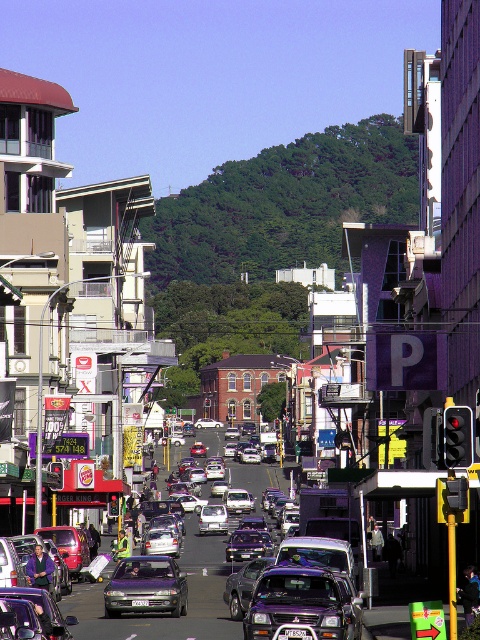
Question: Among these objects, which one is nearest to the camera?

Choices:
 (A) metallic purple sedan at center
 (B) purple metallic suv at center
 (C) metallic silver sedan at center
 (D) black plastic license plate at center

Answer: (D)

Question: Which of the following is the farthest from the observer?

Choices:
 (A) purple metallic suv at center
 (B) purple metallic sedan at center

Answer: (B)

Question: Does metallic silver sedan at center have a lesser width compared to white plastic license plate at center?

Choices:
 (A) no
 (B) yes

Answer: (A)

Question: Can you confirm if purple metallic suv at center is thinner than metallic silver sedan at center?

Choices:
 (A) no
 (B) yes

Answer: (B)

Question: Which of the following is the farthest from the observer?

Choices:
 (A) (144, 604)
 (B) (292, 632)
 (C) (236, 544)
 (D) (307, 608)

Answer: (C)

Question: Is purple metallic suv at center bigger than purple metallic sedan at center?

Choices:
 (A) no
 (B) yes

Answer: (A)